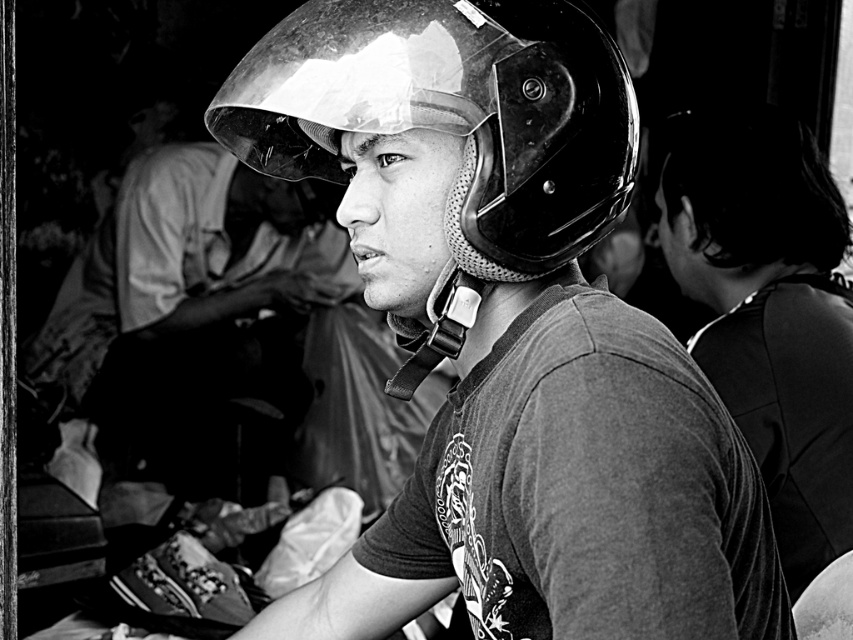
You are a photographer trying to capture a closeup of the glossy black helmet at center and the shiny black helmet at center in the image. Can you fit both helmets into your camera frame that has a maximum width of 10 centimeters?

The glossy black helmet at center is 5.58 centimeters away from the shiny black helmet at center. Since the distance between them is less than the camera frame width of 10 centimeters, both helmets can fit into the frame.

You are a photographer analyzing this image. You notice the glossy black helmet at center and the smooth black shirt at center. Based on their positions, which object is closer to the left edge of the photo?

The glossy black helmet at center is to the left of the smooth black shirt at center, so it is closer to the left edge of the photo.

You are a photographer analyzing this image. The glossy black helmet at center is positioned at a specific coordinate. Can you determine its location relative to the image frame?

The glossy black helmet at center is located at the coordinates point (508, 332), which places it near the center of the image frame.